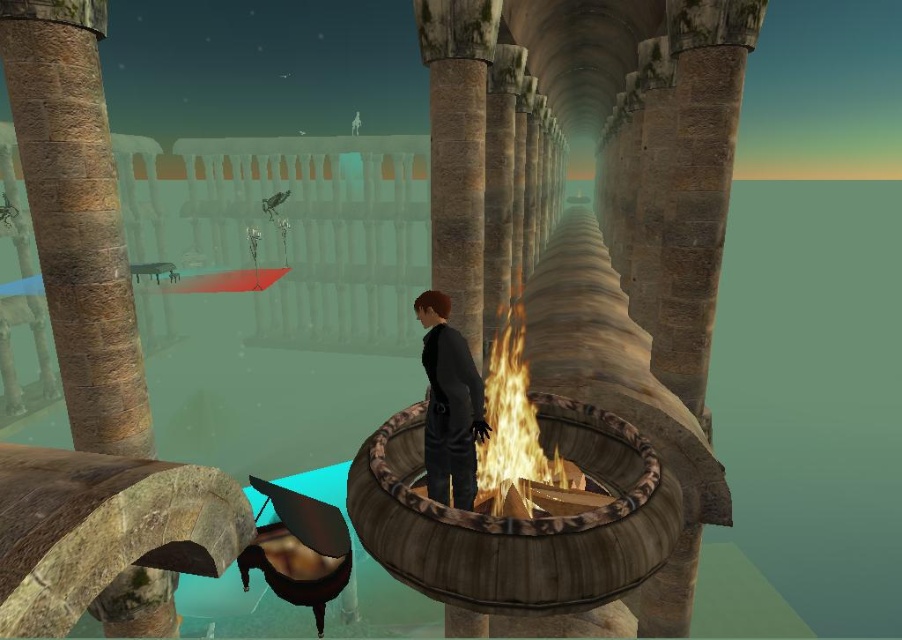
Question: Estimate the real-world distances between objects in this image. Which object is farther from the dark matte coat at center?

Choices:
 (A) brown stone pillar at left
 (B) flamewooden" at "center

Answer: (A)

Question: Is brown stone pillar at left above dark matte coat at center?

Choices:
 (A) yes
 (B) no

Answer: (B)

Question: Observing the image, what is the correct spatial positioning of rustic wood fire pit at center in reference to flamewooden" at "center?

Choices:
 (A) above
 (B) below

Answer: (B)

Question: Among these objects, which one is nearest to the camera?

Choices:
 (A) rustic wood fire pit at center
 (B) dark matte coat at center
 (C) flamewooden" at "center

Answer: (A)

Question: Which of the following is the farthest from the observer?

Choices:
 (A) flamewooden" at "center
 (B) rustic wood fire pit at center

Answer: (A)

Question: Is flamewooden" at "center to the right of dark matte coat at center from the viewer's perspective?

Choices:
 (A) no
 (B) yes

Answer: (B)